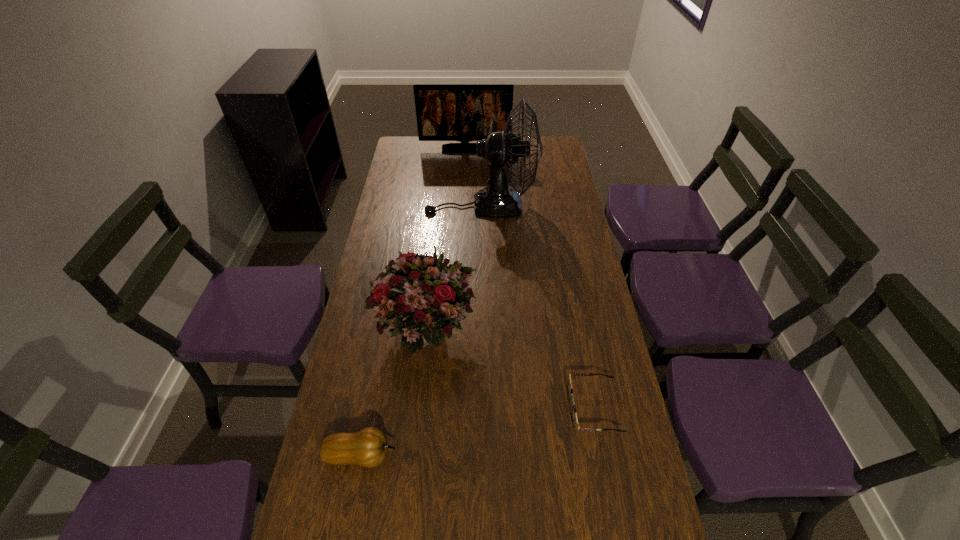
What are the coordinates of `vacant space located on the front-facing side of the farthest object` in the screenshot? It's located at (463, 203).

Locate an element on the screen. blank space located on the right of the third nearest object is located at coordinates (551, 333).

I want to click on free point located on the stem side of the nearest object, so click(x=458, y=455).

This screenshot has height=540, width=960. I want to click on vacant space located on the frame of the shortest object, so click(x=431, y=408).

Find the location of `vacant space located on the frame of the shortest object`. vacant space located on the frame of the shortest object is located at coordinates (506, 408).

Where is `vacant area located 0.210m on the frame of the shortest object`? The width and height of the screenshot is (960, 540). vacant area located 0.210m on the frame of the shortest object is located at coordinates (491, 408).

Locate an element on the screen. object that is positioned at the far edge is located at coordinates (445, 112).

At what (x,y) coordinates should I click in order to perform the action: click on monitor that is at the left edge. Please return your answer as a coordinate pair (x, y). The image size is (960, 540). Looking at the image, I should click on (445, 112).

In order to click on bouquet at the left edge in this screenshot , I will do `click(424, 299)`.

The image size is (960, 540). What are the coordinates of `gourd at the left edge` in the screenshot? It's located at (368, 447).